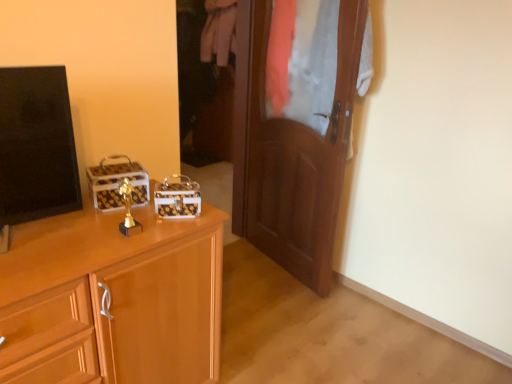
Locate an element on the screen. The width and height of the screenshot is (512, 384). free space in front of black glossy tv at left is located at coordinates (36, 263).